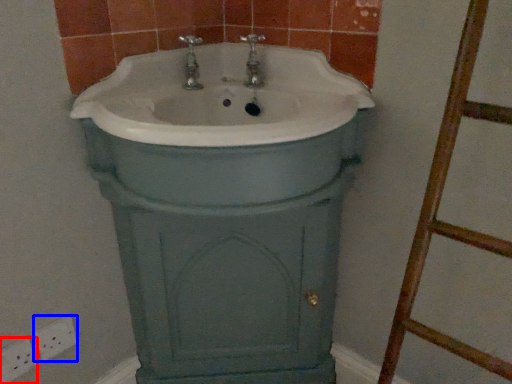
Question: Which object is closer to the camera taking this photo, electric outlet (highlighted by a red box) or electric outlet (highlighted by a blue box)?

Choices:
 (A) electric outlet
 (B) electric outlet

Answer: (A)